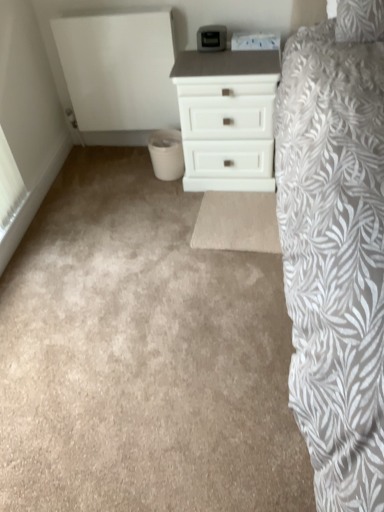
Locate an element on the screen. Image resolution: width=384 pixels, height=512 pixels. vacant space situated above white matte chest of drawers at center (from a real-world perspective) is located at coordinates (226, 52).